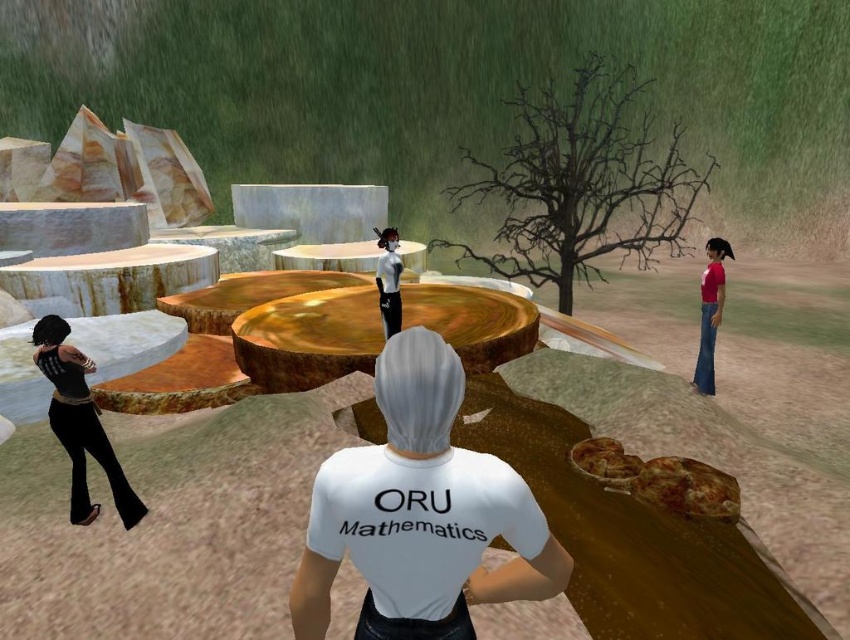
You are navigating a 3D simulation and need to determine the closest point to the camera between the two points marked as point (554, 218) and point (142, 506). Which point is closer to the camera?

Point (554, 218) is further to the camera than point (142, 506), so the closer point to the camera is point (142, 506).

You are a game character trying to locate two teammates in a virtual environment. You see a white matte shirt at center and a velvet black pants at left. Which teammate is positioned more to the left?

The velvet black pants at left is positioned more to the left than the white matte shirt at center.

You are navigating a virtual environment and need to move from point A to point B. Point A is located at coordinates point (401,557) and point B is at point (60,362). According to the scene, which point is closer to your current position if you are facing the direction the white hair character is facing?

Point (401,557) is in front of point (60,362), so if you are facing the direction the white hair character is facing, point (401,557) would be closer to your current position since it is in front of point (60,362).